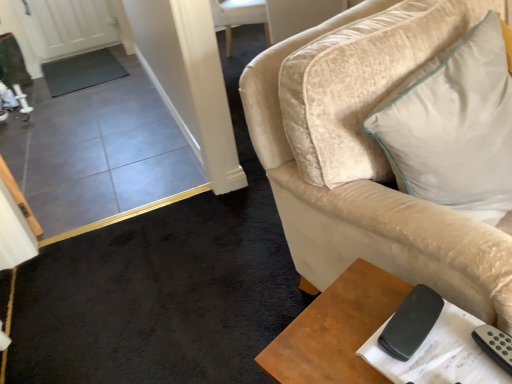
Locate an element on the screen. The width and height of the screenshot is (512, 384). free location above brown wooden table at lower right (from a real-world perspective) is located at coordinates coord(384,336).